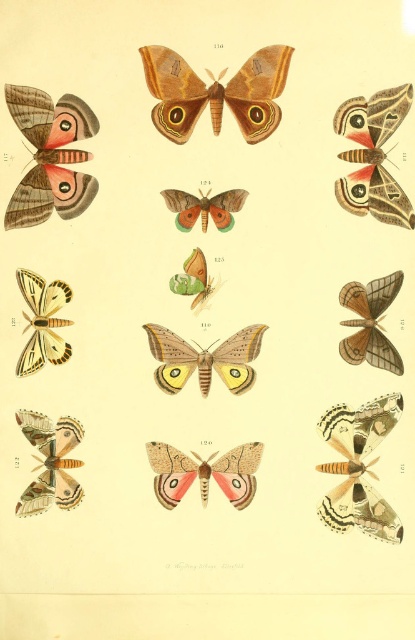
Question: Among these points, which one is nearest to the camera?

Choices:
 (A) (188, 284)
 (B) (395, 369)
 (C) (170, 196)
 (D) (41, 324)

Answer: (B)

Question: Is matte brown butterfly at center behind matte brown butterfly at lower left?

Choices:
 (A) no
 (B) yes

Answer: (A)

Question: Which object is closer to the camera taking this photo?

Choices:
 (A) translucent brown moth at center right
 (B) matte yellow butterfly at center
 (C) matte brown butterfly at upper right

Answer: (C)

Question: Can you confirm if translucent beige moth at center is thinner than green matte butterfly at center?

Choices:
 (A) no
 (B) yes

Answer: (A)

Question: Can you confirm if matte yellow butterfly at center is thinner than matte orange butterfly at center?

Choices:
 (A) yes
 (B) no

Answer: (B)

Question: Considering the real-world distances, which object is farthest from the matte brown butterfly at center?

Choices:
 (A) green matte butterfly at center
 (B) matte brown butterfly at upper right
 (C) brown textured moth at center
 (D) matte yellow butterfly at center

Answer: (C)